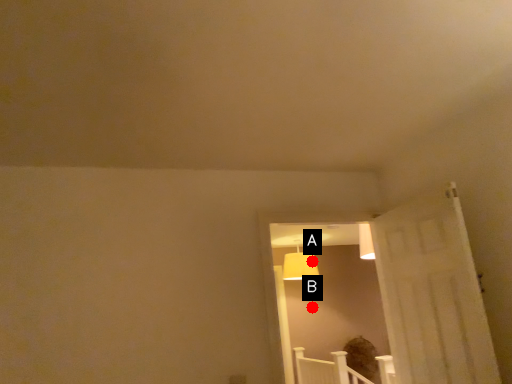
Question: Two points are circled on the image, labeled by A and B beside each circle. Which point is closer to the camera?

Choices:
 (A) A is closer
 (B) B is closer

Answer: (B)